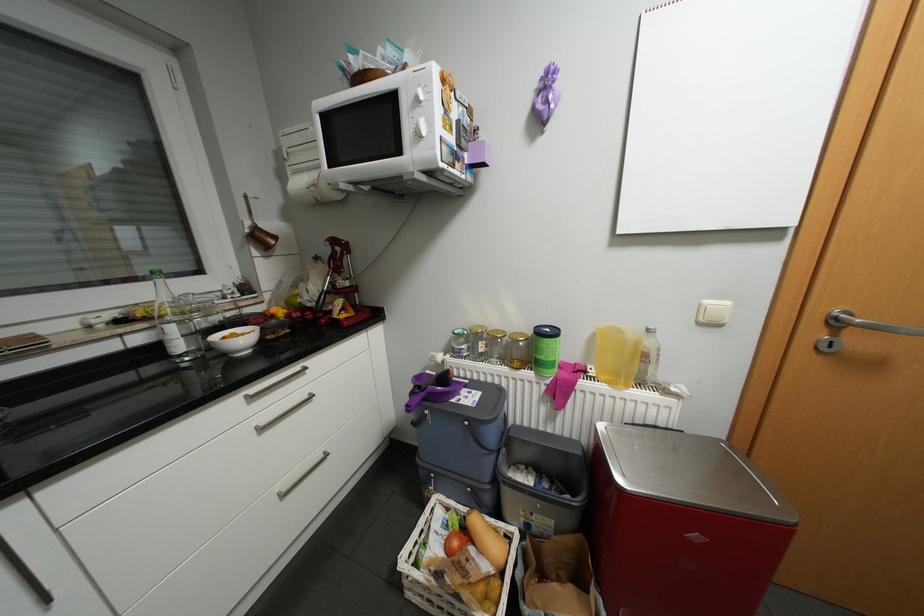
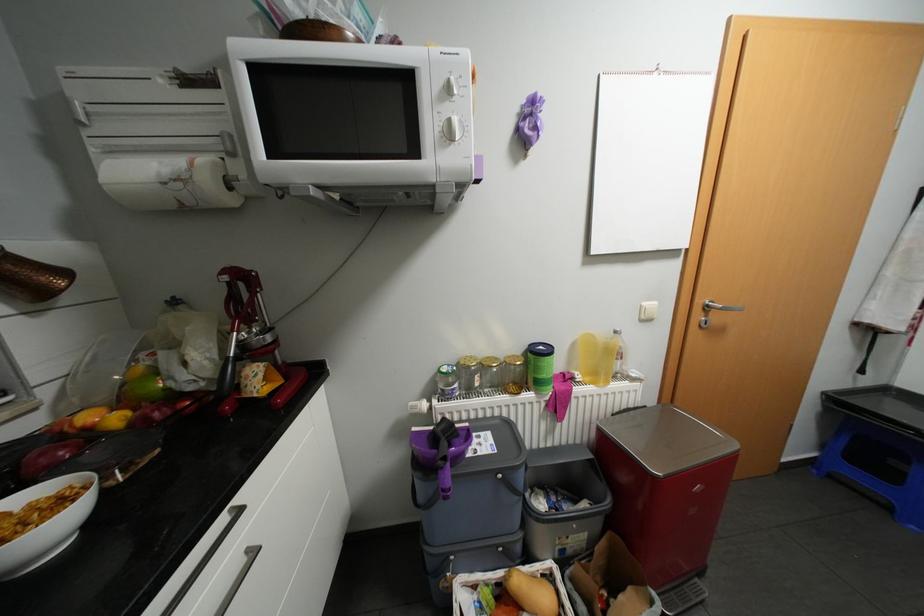
The point at (512, 331) is marked in the first image. Where is the corresponding point in the second image?

(504, 358)